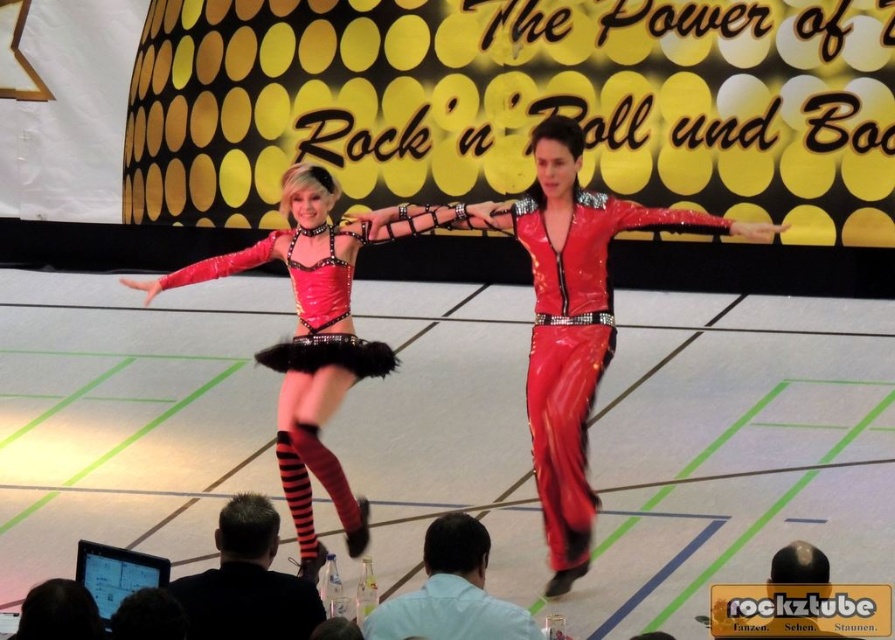
Question: Is black leather jacket at lower center above black laptop at lower left?

Choices:
 (A) no
 (B) yes

Answer: (B)

Question: From the image, what is the correct spatial relationship of black laptop at lower left in relation to dark hair at lower left?

Choices:
 (A) left
 (B) right

Answer: (A)

Question: Among these points, which one is nearest to the camera?

Choices:
 (A) (578, 520)
 (B) (496, 609)
 (C) (295, 429)

Answer: (B)

Question: Which is nearer to the light blue shirt at lower center?

Choices:
 (A) shiny red jumpsuit at center
 (B) shiny red dress at center

Answer: (A)

Question: Which object is positioned closest to the shiny red dress at center?

Choices:
 (A) black leather jacket at lower center
 (B) shiny red jumpsuit at center
 (C) dark hair at lower left
 (D) black laptop at lower left

Answer: (B)

Question: Does black leather jacket at lower center appear over dark hair at lower left?

Choices:
 (A) yes
 (B) no

Answer: (A)